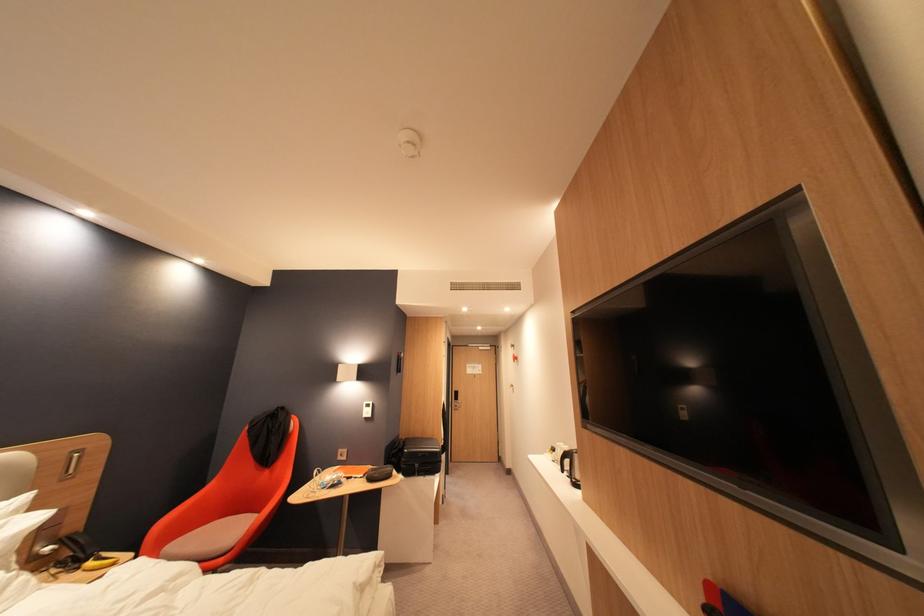
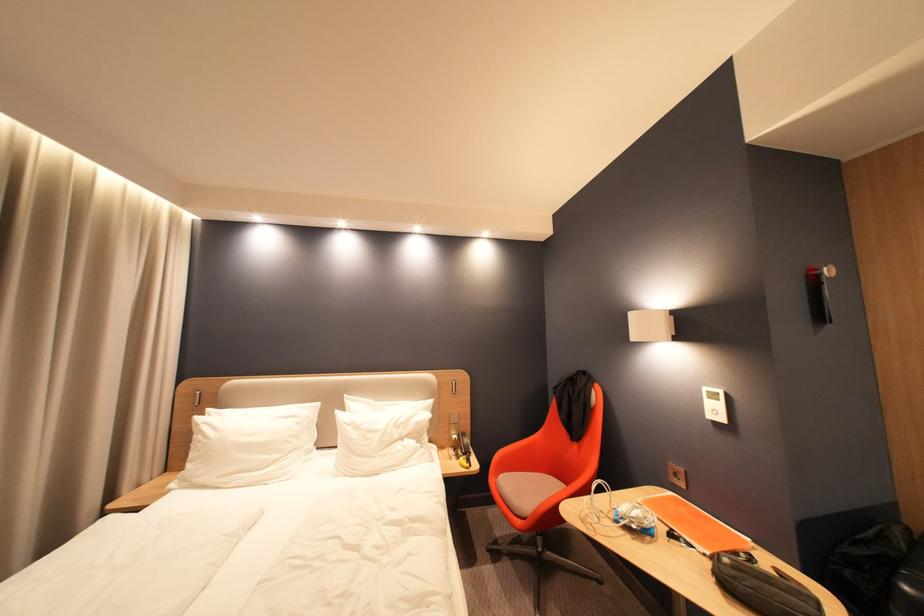
Question: I am providing you with two images of the same scene from different viewpoints. Which of the following objects are not visible in image2?

Choices:
 (A) orange chair armrest
 (B) black bag
 (C) chair sitting surface
 (D) none of these

Answer: (D)